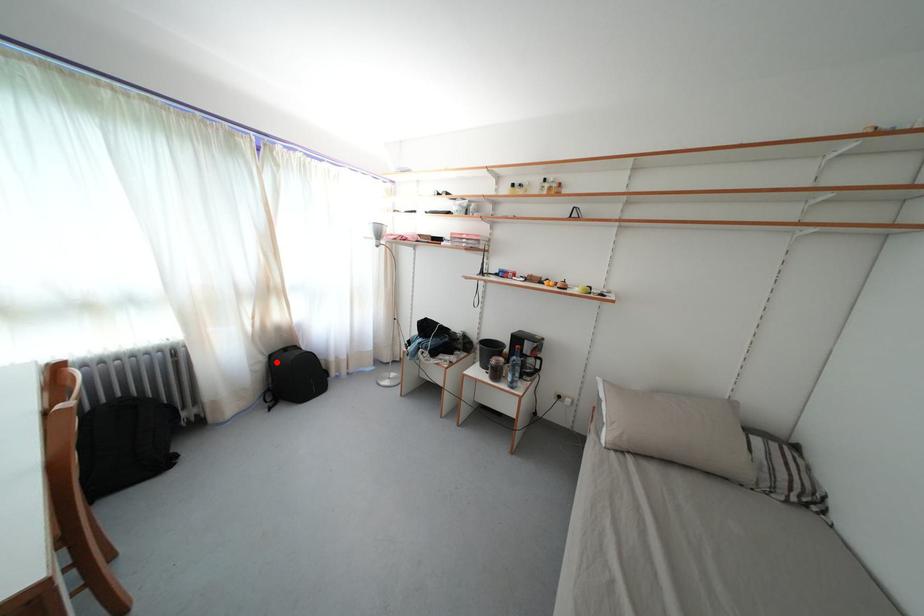
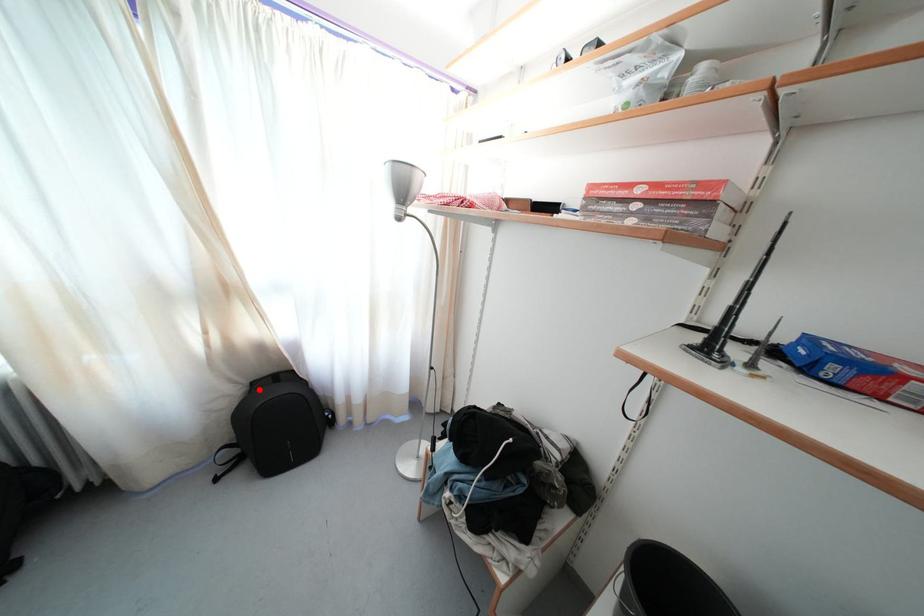
I am providing you with two images of the same scene from different viewpoints. A red point is marked on the first image and another point is marked on the second image. Is the red point in image1 aligned with the point shown in image2?

Yes